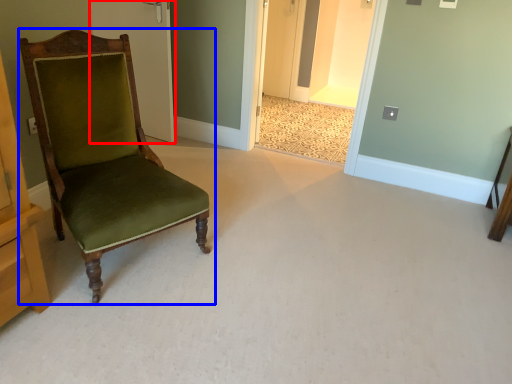
Question: Which point is closer to the camera, door (highlighted by a red box) or chair (highlighted by a blue box)?

Choices:
 (A) door
 (B) chair

Answer: (B)